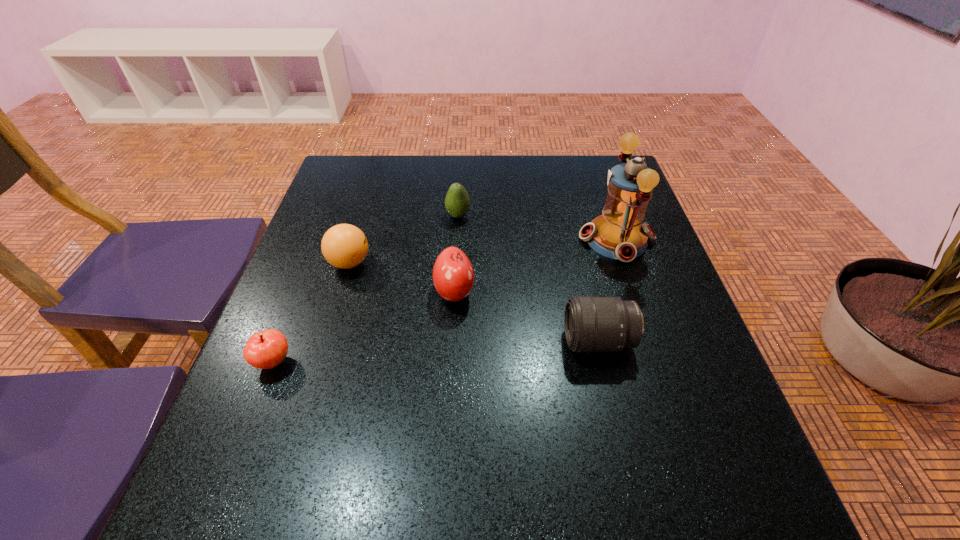
Locate an element on the screen. This screenshot has width=960, height=540. the tallest object is located at coordinates (618, 233).

Image resolution: width=960 pixels, height=540 pixels. I want to click on the right apple, so click(453, 276).

Locate an element on the screen. This screenshot has height=540, width=960. the farther apple is located at coordinates (453, 276).

Locate an element on the screen. telephoto lens is located at coordinates (592, 324).

Find the location of `ping-pong ball`. ping-pong ball is located at coordinates (344, 246).

You are a GUI agent. You are given a task and a screenshot of the screen. Output one action in this format:
    pyautogui.click(x=<x>, y=<y>)
    Task: Click on the avocado
    This screenshot has height=540, width=960.
    Given the screenshot: What is the action you would take?
    pyautogui.click(x=457, y=202)

Locate an element on the screen. This screenshot has width=960, height=540. the nearer apple is located at coordinates (266, 349).

What are the coordinates of `the left apple` in the screenshot? It's located at (266, 349).

This screenshot has width=960, height=540. What are the coordinates of `vacant point located on the front-facing side of the tallest object` in the screenshot? It's located at (530, 240).

At what (x,y) coordinates should I click in order to perform the action: click on free spot located 0.070m on the front-facing side of the tallest object. Please return your answer as a coordinate pair (x, y). Looking at the image, I should click on (550, 240).